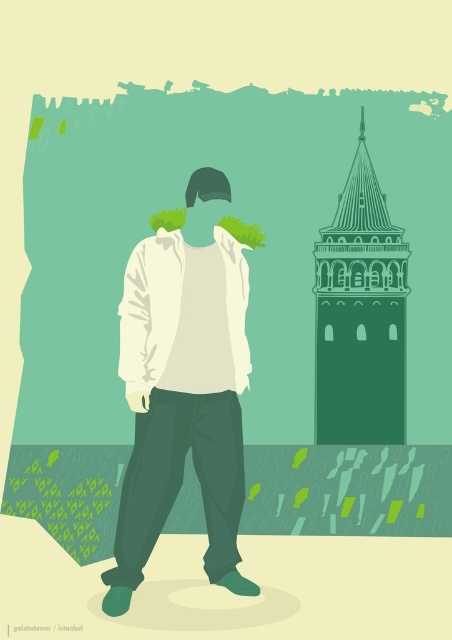
Where is `white matte shirt at center`? The width and height of the screenshot is (452, 640). white matte shirt at center is located at coordinates (183, 400).

Who is lower down, white matte shirt at center or green line drawing tower at right?

A: white matte shirt at center is below.

What do you see at coordinates (183, 400) in the screenshot?
I see `white matte shirt at center` at bounding box center [183, 400].

At what (x,y) coordinates should I click in order to perform the action: click on white matte shirt at center. Please return your answer as a coordinate pair (x, y). This screenshot has height=640, width=452. Looking at the image, I should click on (183, 400).